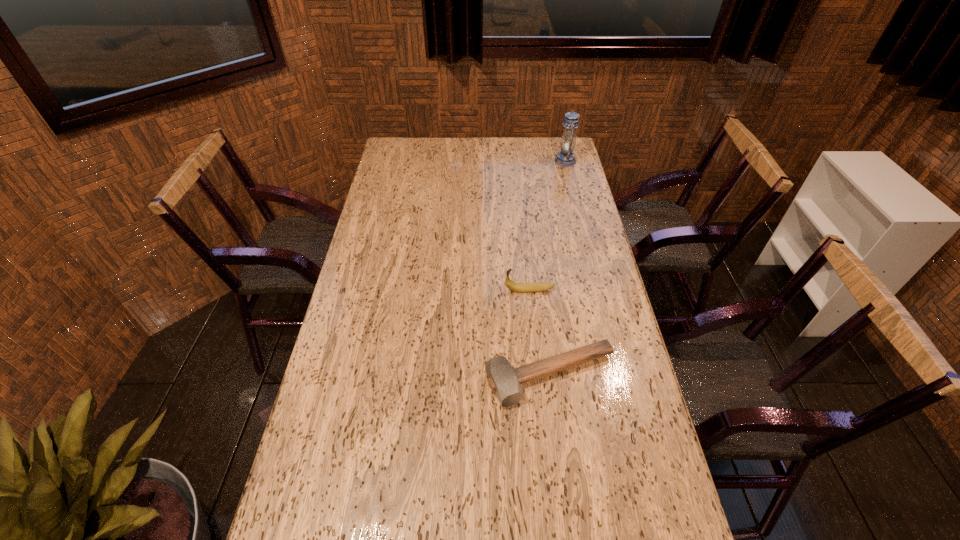
The height and width of the screenshot is (540, 960). I want to click on the farthest object, so click(x=565, y=157).

Where is `lantern`? lantern is located at coordinates (565, 157).

Find the location of `banana`. banana is located at coordinates [514, 286].

The height and width of the screenshot is (540, 960). I want to click on the second farthest object, so click(514, 286).

The image size is (960, 540). I want to click on the nearest object, so click(x=504, y=381).

I want to click on mallet, so click(504, 381).

At what (x,y) coordinates should I click in order to perform the action: click on vacant space located on the front-facing side of the farthest object. Please return your answer as a coordinate pair (x, y). This screenshot has height=540, width=960. Looking at the image, I should click on (467, 161).

Identify the location of blank space located on the front-facing side of the farthest object. This screenshot has width=960, height=540. (541, 161).

At what (x,y) coordinates should I click in order to perform the action: click on free space located on the front-facing side of the farthest object. Please return your answer as a coordinate pair (x, y). Image resolution: width=960 pixels, height=540 pixels. Looking at the image, I should click on (511, 161).

The image size is (960, 540). Identify the location of vacant space situated at the stem of the banana. (477, 290).